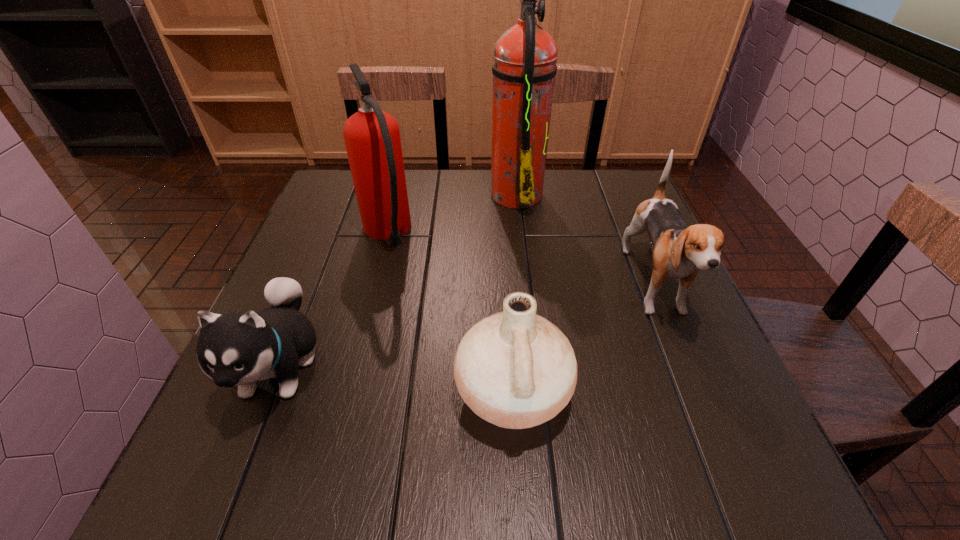
The width and height of the screenshot is (960, 540). In order to click on object present at the near edge in this screenshot , I will do coord(515,369).

Locate an element on the screen. The height and width of the screenshot is (540, 960). fire extinguisher positioned at the left edge is located at coordinates (372, 138).

This screenshot has height=540, width=960. I want to click on puppy that is at the left edge, so click(x=239, y=348).

Find the location of `object located at the right edge`. object located at the right edge is located at coordinates (679, 252).

The width and height of the screenshot is (960, 540). I want to click on object that is positioned at the far left corner, so click(372, 138).

In the image, there is a desktop. Where is `blank space at the far edge`? The height and width of the screenshot is (540, 960). blank space at the far edge is located at coordinates (534, 207).

Where is `free region at the near edge`? free region at the near edge is located at coordinates (653, 464).

The width and height of the screenshot is (960, 540). I want to click on free space at the left edge, so click(x=333, y=318).

Identify the location of free space at the right edge of the desktop. The image size is (960, 540). (608, 244).

In the image, there is a desktop. At what (x,y) coordinates should I click in order to perform the action: click on vacant space at the far left corner. Please return your answer as a coordinate pair (x, y). This screenshot has width=960, height=540. Looking at the image, I should click on (345, 213).